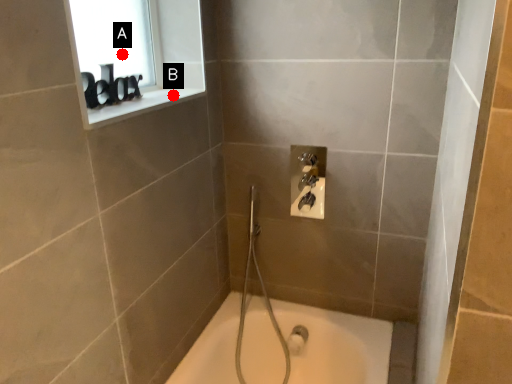
Question: Two points are circled on the image, labeled by A and B beside each circle. Among these points, which one is nearest to the camera?

Choices:
 (A) A is closer
 (B) B is closer

Answer: (B)